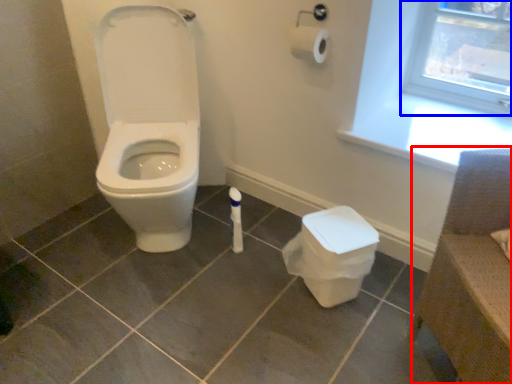
Question: Which object is closer to the camera taking this photo, chair (highlighted by a red box) or window frame (highlighted by a blue box)?

Choices:
 (A) chair
 (B) window frame

Answer: (A)